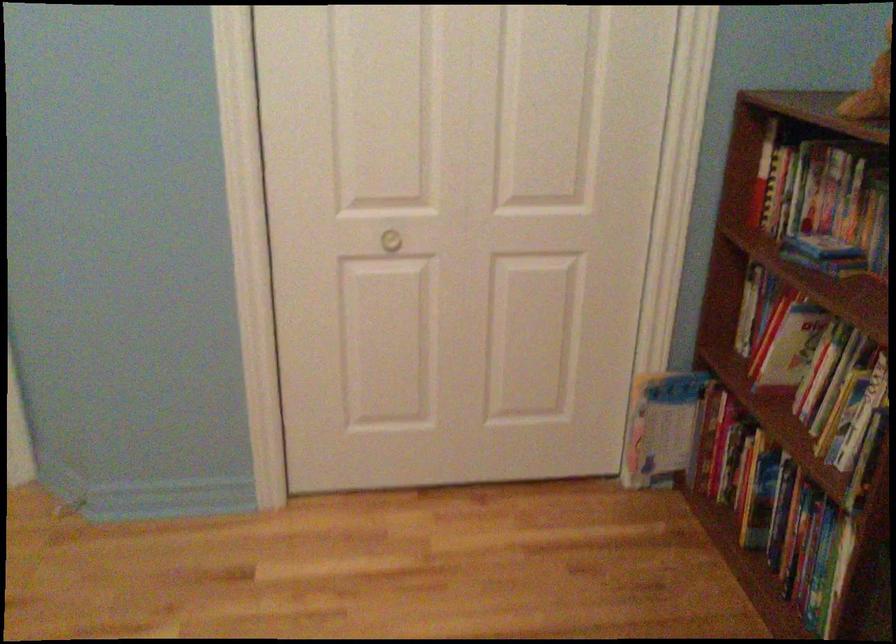
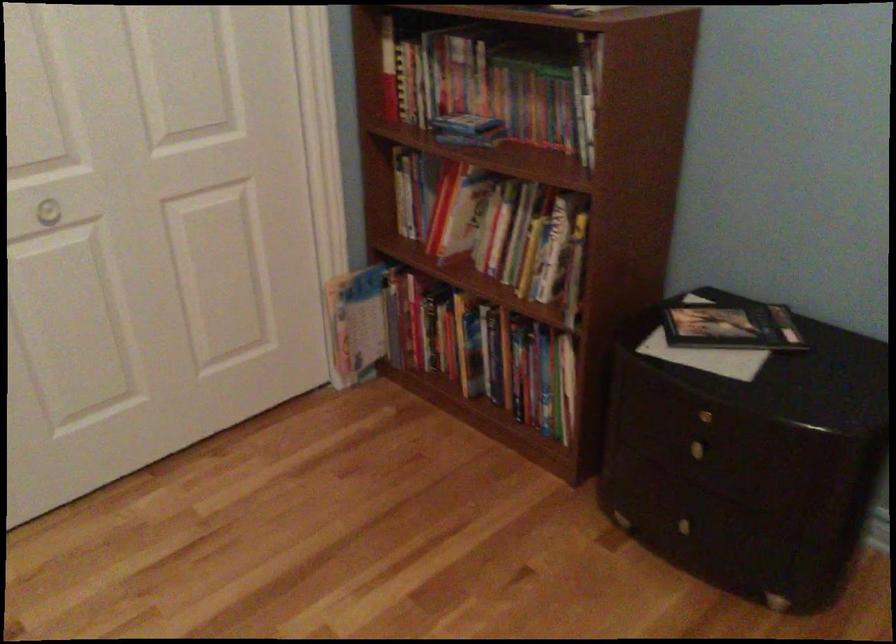
Find the pixel in the second image that matches pixel 771 191 in the first image.

(399, 84)